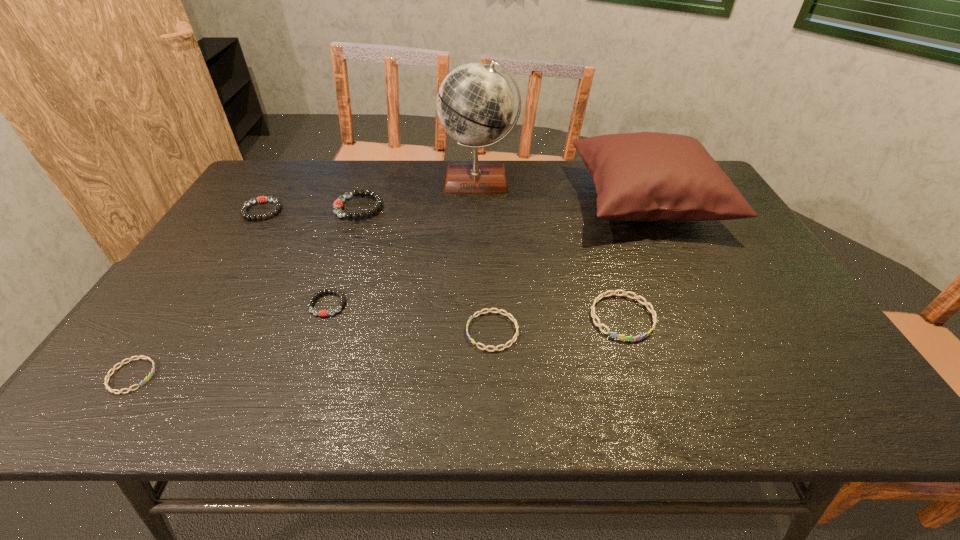
Identify the location of globe. Image resolution: width=960 pixels, height=540 pixels. (475, 104).

This screenshot has width=960, height=540. Identify the location of cushion. (645, 176).

Locate an element on the screen. This screenshot has height=540, width=960. the sixth shortest object is located at coordinates (337, 207).

Where is `the biggest black bracelet`? This screenshot has width=960, height=540. the biggest black bracelet is located at coordinates point(337,207).

Locate an element on the screen. This screenshot has height=540, width=960. the rightmost bracelet is located at coordinates (614, 334).

Find the location of a particular element. the rightmost blue bracelet is located at coordinates (614, 334).

You are a GUI agent. You are given a task and a screenshot of the screen. Output one action in this format:
    pyautogui.click(x=<x>, y=<y>)
    Task: Click on the leftmost black bracelet
    
    Given the screenshot: What is the action you would take?
    pyautogui.click(x=262, y=199)

The height and width of the screenshot is (540, 960). I want to click on the second smallest blue bracelet, so click(x=488, y=310).

At what (x,y) coordinates should I click in order to perform the action: click on the fifth bracelet from left to right. Please return your answer as a coordinate pair (x, y). Looking at the image, I should click on (488, 310).

The height and width of the screenshot is (540, 960). What are the coordinates of `the smallest black bracelet` in the screenshot? It's located at (322, 313).